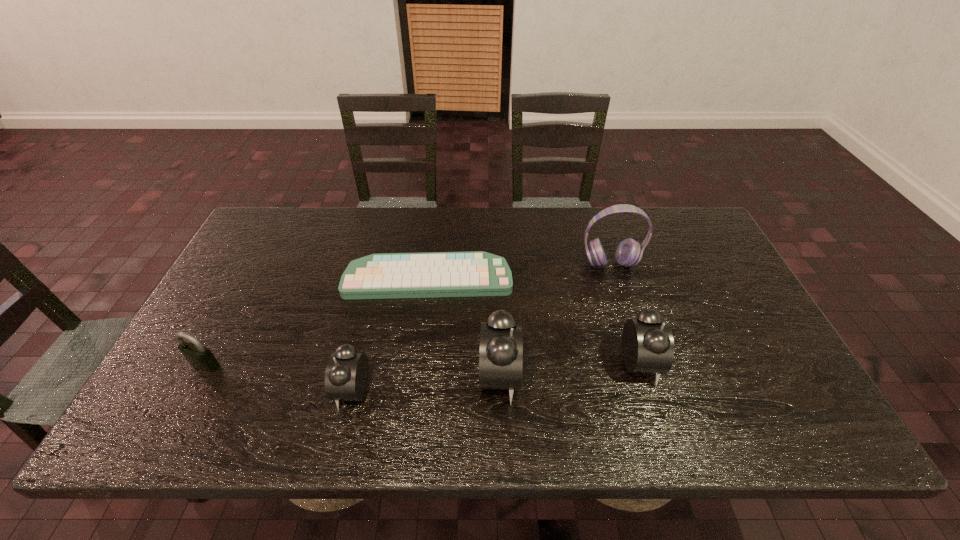
This screenshot has height=540, width=960. In order to click on free space located 0.400m on the front side of the second alarm clock from left to right in this screenshot , I will do `click(690, 376)`.

The width and height of the screenshot is (960, 540). Find the location of `vacant space located on the front side of the rightmost alarm clock`. vacant space located on the front side of the rightmost alarm clock is located at coordinates (773, 364).

In order to click on free space located on the headband and ear cups of the headset in this screenshot , I will do `click(636, 345)`.

Locate an element on the screen. Image resolution: width=960 pixels, height=540 pixels. free space located 0.170m on the back of the shortest object is located at coordinates (435, 225).

Locate an element on the screen. This screenshot has width=960, height=540. blank space located 0.140m on the right of the leftmost object is located at coordinates (279, 365).

In order to click on padlock located at the near edge in this screenshot , I will do `click(200, 357)`.

Locate an element on the screen. This screenshot has height=540, width=960. object positioned at the left edge is located at coordinates (200, 357).

This screenshot has height=540, width=960. In order to click on object present at the near left corner in this screenshot , I will do `click(200, 357)`.

The height and width of the screenshot is (540, 960). In the image, there is a desktop. In order to click on blank space at the far edge in this screenshot , I will do `click(475, 238)`.

The height and width of the screenshot is (540, 960). Identify the location of vacant space at the near edge. (615, 395).